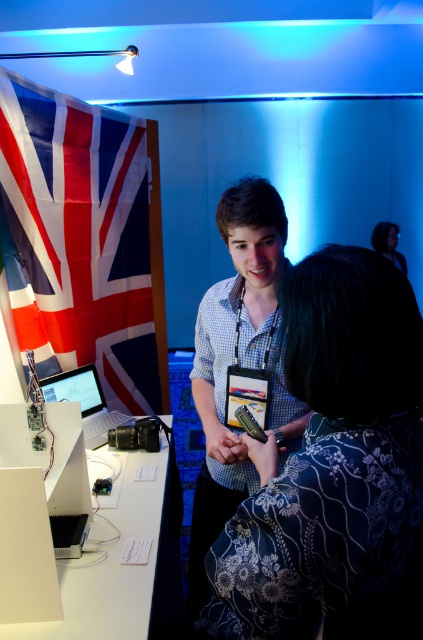
Question: Which of the following is the farthest from the observer?

Choices:
 (A) (203, 492)
 (B) (82, 390)
 (C) (318, 332)
 (D) (395, 241)

Answer: (D)

Question: Among these objects, which one is nearest to the camera?

Choices:
 (A) checkered fabric shirt at center
 (B) red and white fabric flag at left
 (C) floral fabric dress at center

Answer: (C)

Question: Which of these objects is positioned farthest from the floral fabric dress at center?

Choices:
 (A) red and white fabric flag at left
 (B) black leather jacket at upper right

Answer: (B)

Question: Considering the relative positions of checkered fabric shirt at center and white plastic computer at lower left in the image provided, where is checkered fabric shirt at center located with respect to white plastic computer at lower left?

Choices:
 (A) right
 (B) left

Answer: (A)

Question: Does red and white fabric flag at left appear over checkered fabric shirt at center?

Choices:
 (A) no
 (B) yes

Answer: (B)

Question: Is red and white fabric flag at left smaller than black leather jacket at upper right?

Choices:
 (A) no
 (B) yes

Answer: (A)